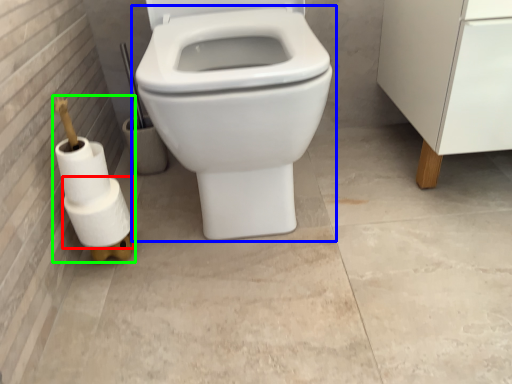
Question: Which is nearer to the toilet paper (highlighted by a red box)? toilet (highlighted by a blue box) or toilet paper (highlighted by a green box).

Choices:
 (A) toilet
 (B) toilet paper

Answer: (B)